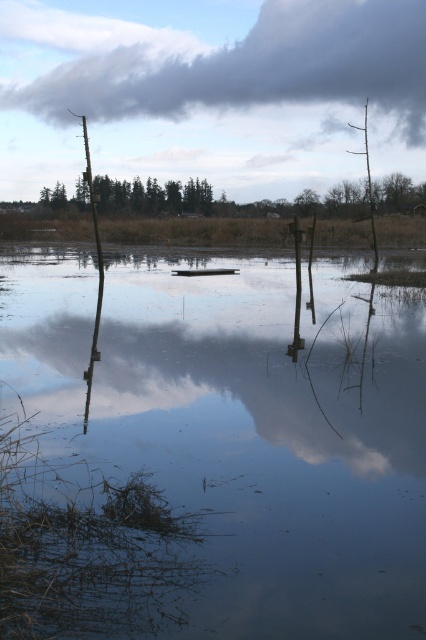
Is smooth reflective water at center thinner than cloudy gray cloud at upper center?

Answer: Yes.

Who is more forward, (293, 512) or (167, 35)?

Point (293, 512)

Is point (86, 337) positioned in front of point (74, 81)?

Yes, point (86, 337) is closer to viewer.

This screenshot has width=426, height=640. Identify the location of smooth reflective water at center. (209, 451).